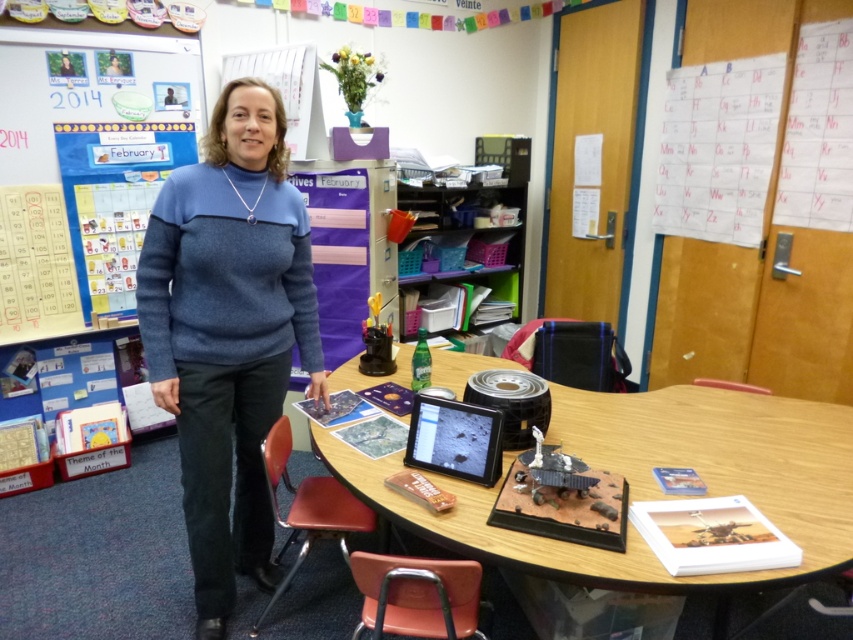
Question: Among these objects, which one is nearest to the camera?

Choices:
 (A) whiteboard at upper left
 (B) blue wool sweater at center
 (C) wooden table at center

Answer: (C)

Question: Can you confirm if wooden table at center is positioned to the left of whiteboard at upper left?

Choices:
 (A) yes
 (B) no

Answer: (B)

Question: Which point appears farthest from the camera in this image?

Choices:
 (A) (680, 412)
 (B) (15, 232)
 (C) (245, 115)

Answer: (B)

Question: Which of these objects is positioned farthest from the whiteboard at upper left?

Choices:
 (A) blue wool sweater at center
 (B) wooden table at center

Answer: (B)

Question: Is blue wool sweater at center smaller than whiteboard at upper left?

Choices:
 (A) no
 (B) yes

Answer: (B)

Question: Does blue wool sweater at center have a smaller size compared to wooden table at center?

Choices:
 (A) no
 (B) yes

Answer: (B)